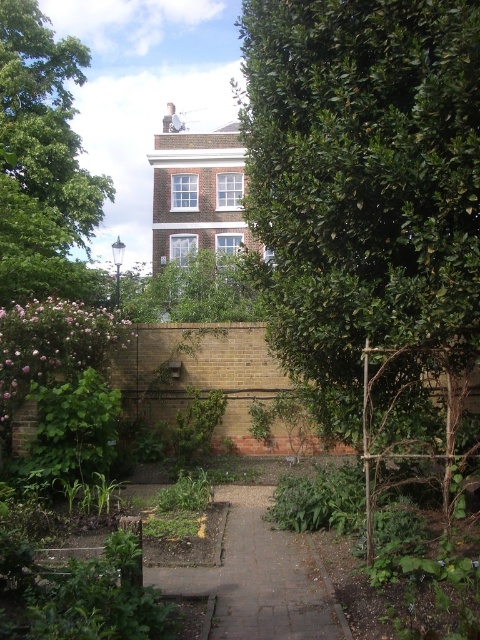
You are walking in the garden and want to reach the brick building in the background. Which direction should you go from the green leafy hedge at lower left and the paved stone path at center to get closer to the building?

To reach the brick building in the background, you should move towards the paved stone path at center since it is positioned on the right side of the green leafy hedge at lower left, indicating it leads towards the building.

You are standing in the garden and want to walk to the brick building in the background. Which object should you avoid stepping on to stay on the path? The paved stone path at center or the green leafy hedge at lower left?

You should avoid stepping on the green leafy hedge at lower left because the paved stone path at center is closer to the viewer and likely the intended path towards the brick building.

You are planning to plant a new tree in the garden. The green leafy tree at upper center is currently the largest plant in the area. Considering its size, would it be advisable to plant a smaller tree near the paved stone path at center?

The green leafy tree at upper center is larger than the paved stone path at center, so planting a smaller tree near the paved stone path at center is advisable to avoid overcrowding the area.